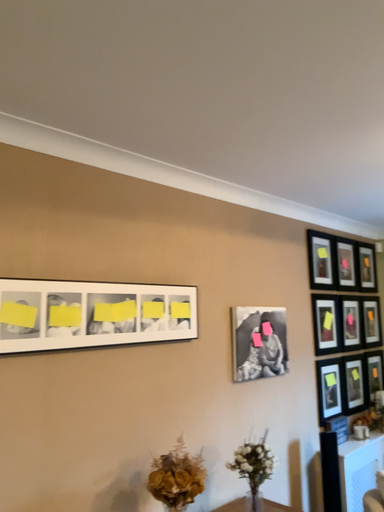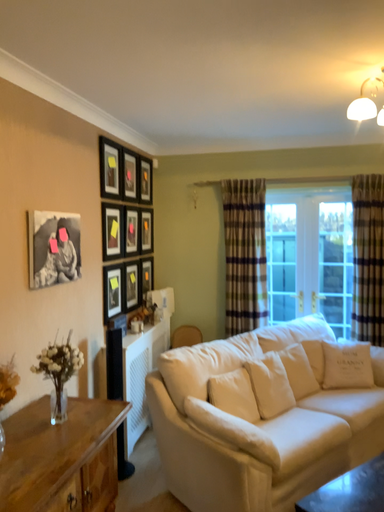
Question: Which way did the camera rotate in the video?

Choices:
 (A) rotated downward
 (B) rotated upward

Answer: (A)